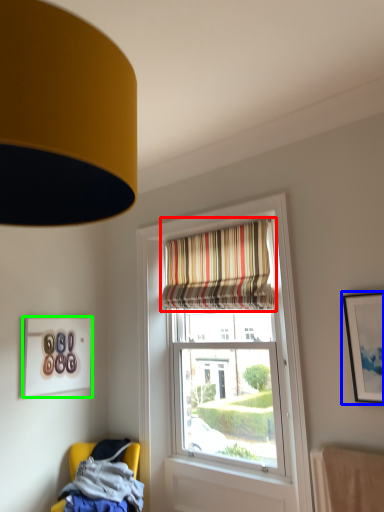
Question: Based on their relative distances, which object is nearer to curtain (highlighted by a red box)? Choose from picture frame (highlighted by a blue box) and picture frame (highlighted by a green box).

Choices:
 (A) picture frame
 (B) picture frame

Answer: (A)